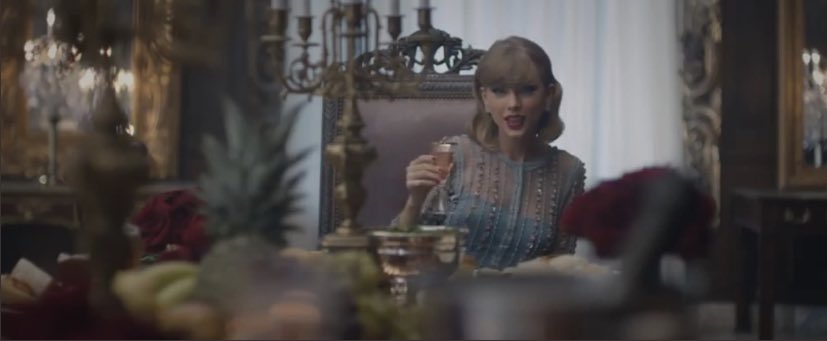
Locate an element on the screen. chair at table is located at coordinates (416, 109).